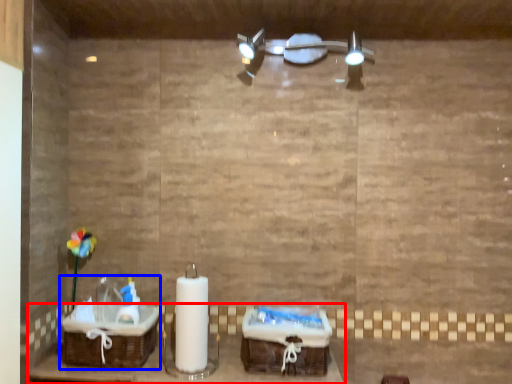
Question: Which point is closer to the camera, furniture (highlighted by a red box) or sink (highlighted by a blue box)?

Choices:
 (A) furniture
 (B) sink

Answer: (A)